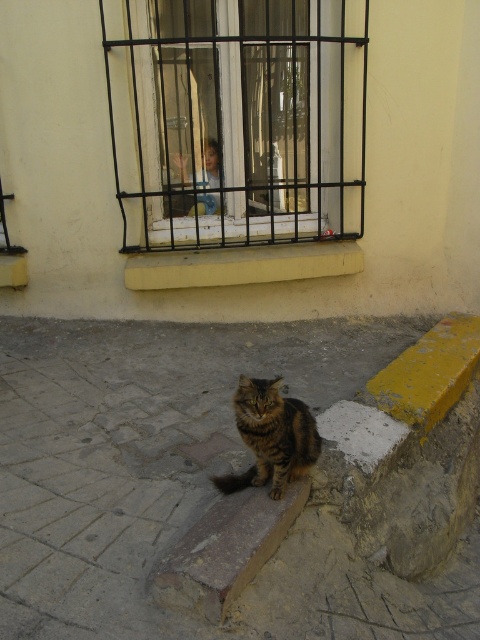
Question: Considering the real-world distances, which object is closest to the smooth concrete pavement at lower center?

Choices:
 (A) black metal bars at upper center
 (B) tabby fur cat at center
 (C) yellow concrete at center

Answer: (B)

Question: Is smooth concrete pavement at lower center above yellow concrete at center?

Choices:
 (A) no
 (B) yes

Answer: (A)

Question: Which of the following is the farthest from the observer?

Choices:
 (A) (193, 285)
 (B) (251, 218)
 (C) (276, 497)
 (D) (181, 356)

Answer: (B)

Question: Is yellow concrete at center below tabby fur cat at center?

Choices:
 (A) yes
 (B) no

Answer: (B)

Question: Which point is closer to the camera?

Choices:
 (A) (142, 140)
 (B) (41, 460)
 (C) (283, 454)
 (D) (228, 266)

Answer: (C)

Question: From the image, what is the correct spatial relationship of smooth concrete pavement at lower center in relation to tabby fur cat at center?

Choices:
 (A) below
 (B) above

Answer: (B)